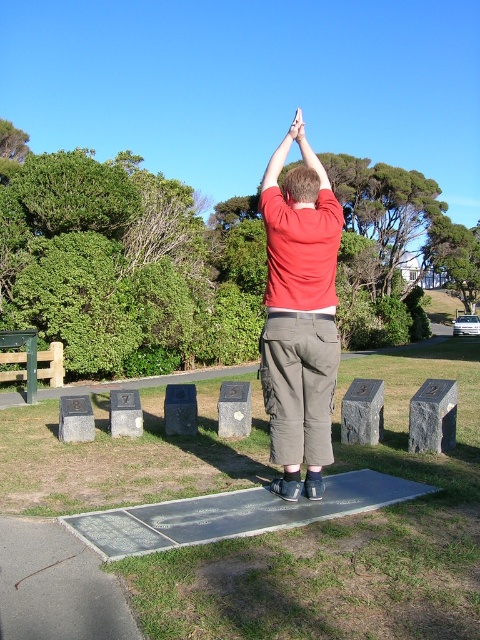
You are a photographer trying to capture the engraved text on the rectangular concrete platform in front of the person. The camera you are using has a limited field of view. Based on the scene, can you determine if the rectangular concrete platform is entirely within your camera frame when focusing on the point at coordinates (x=300, y=314)?

The point at coordinates (x=300, y=314) is on the matte red shirt at center. Since the rectangular concrete platform is in front of the person, it is likely that focusing on the point on their shirt would place the platform outside the camera frame unless adjusted. However, without specific information about the camera angle or field of view, this cannot be definitively confirmed.

You are standing at the center of the paved area and see two points marked as point (269, 273) and point (292, 195). Which point is closer to you?

Point (292, 195) is closer to you because it is in front of point (269, 273).

You are a photographer trying to capture a clear shot of both the matte red shirt at center and the brown hair at upper center in the same frame. Based on their sizes, which one should you focus on first to ensure both are in focus?

The matte red shirt at center is bigger than the brown hair at upper center. To ensure both are in focus, you should focus on the matte red shirt at center first since it is larger and will require more precise focus adjustment.